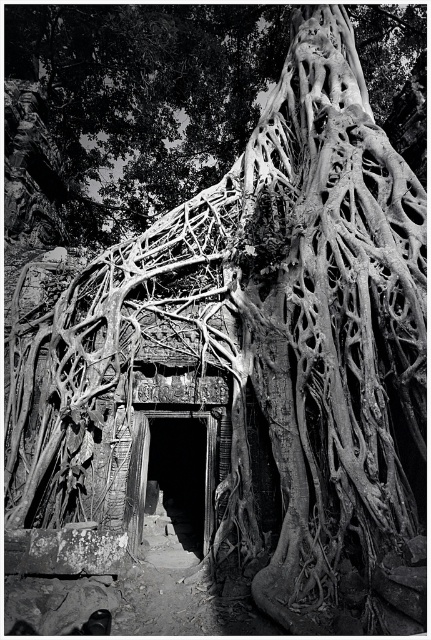
Question: Does rough bark roots at center lie behind dark stone doorway at center?

Choices:
 (A) no
 (B) yes

Answer: (B)

Question: Is rough bark roots at center in front of dark stone doorway at center?

Choices:
 (A) no
 (B) yes

Answer: (A)

Question: Does rough bark roots at center have a greater width compared to dark stone doorway at center?

Choices:
 (A) no
 (B) yes

Answer: (B)

Question: Among these objects, which one is farthest from the camera?

Choices:
 (A) rough bark roots at center
 (B) dark stone doorway at center

Answer: (A)